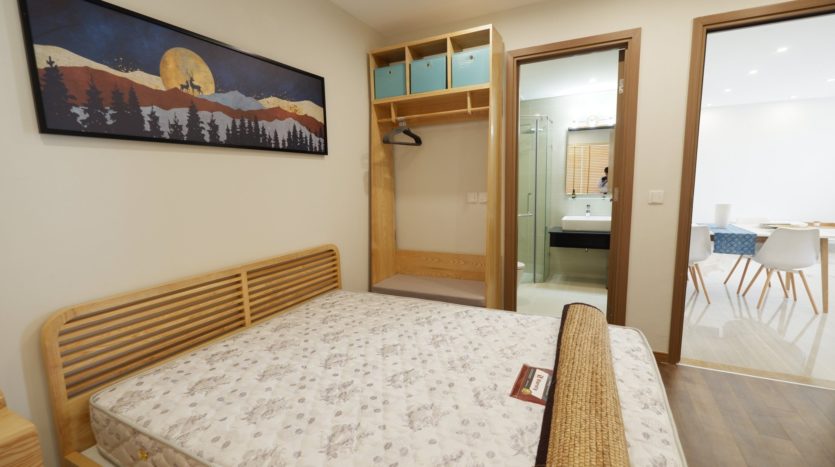
Where is `door jambs`? door jambs is located at coordinates (633, 39), (697, 32).